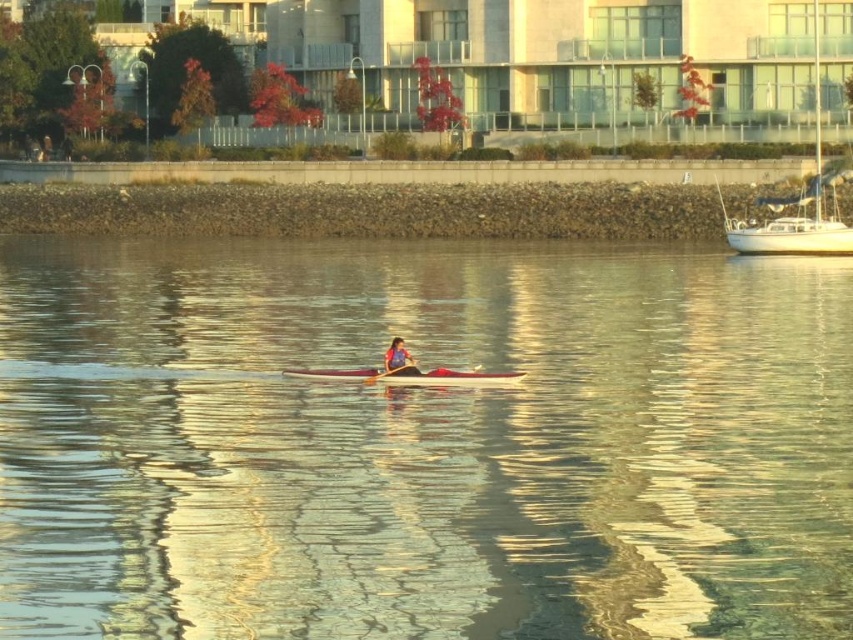
Is white glossy kayak at center thinner than blue fabric kayak at center?

No, white glossy kayak at center is not thinner than blue fabric kayak at center.

Which is in front, point (321, 371) or point (398, 340)?

Point (398, 340)

Is point (498, 372) behind point (399, 340)?

Yes.

At what (x,y) coordinates should I click in order to perform the action: click on white glossy kayak at center. Please return your answer as a coordinate pair (x, y). The image size is (853, 640). Looking at the image, I should click on coord(410,376).

Between point (288, 304) and point (383, 365), which one is positioned in front?

Point (383, 365)

Is clear water at center above wooden paddle at center?

Indeed, clear water at center is positioned over wooden paddle at center.

The height and width of the screenshot is (640, 853). What are the coordinates of `clear water at center` in the screenshot? It's located at (422, 442).

Locate an element on the screen. Image resolution: width=853 pixels, height=640 pixels. clear water at center is located at coordinates (422, 442).

Is clear water at center positioned before blue fabric kayak at center?

Yes, clear water at center is in front of blue fabric kayak at center.

Is clear water at center above blue fabric kayak at center?

Indeed, clear water at center is positioned over blue fabric kayak at center.

In order to click on clear water at center in this screenshot , I will do `click(422, 442)`.

The height and width of the screenshot is (640, 853). I want to click on clear water at center, so click(422, 442).